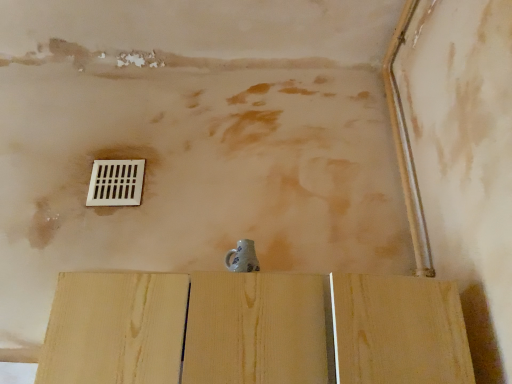
At what (x,y) coordinates should I click in order to perform the action: click on white plastic vent at upper center. Please return your answer as a coordinate pair (x, y). The width and height of the screenshot is (512, 384). Looking at the image, I should click on (116, 183).

Describe the element at coordinates (116, 183) in the screenshot. Image resolution: width=512 pixels, height=384 pixels. I see `white plastic vent at upper center` at that location.

Based on the photo, what is the approximate height of natural wood plywood at center?

It is 10.41 inches.

In order to face natural wood plywood at center, should I rotate leftwards or rightwards?

You should look right and rotate roughly 0.586 degrees.

Where is `natural wood plywood at center`? The height and width of the screenshot is (384, 512). natural wood plywood at center is located at coordinates (255, 329).

This screenshot has height=384, width=512. What do you see at coordinates (255, 329) in the screenshot? I see `natural wood plywood at center` at bounding box center [255, 329].

Locate an element on the screen. white plastic vent at upper center is located at coordinates (116, 183).

Consider the image. Would you say natural wood plywood at center is to the left or to the right of white plastic vent at upper center in the picture?

Based on their positions, natural wood plywood at center is located to the right of white plastic vent at upper center.

Is natural wood plywood at center in front of or behind white plastic vent at upper center in the image?

Clearly, natural wood plywood at center is in front of white plastic vent at upper center.

Between point (98, 287) and point (136, 194), which one is positioned behind?

Point (136, 194)

From the image's perspective, relative to white plastic vent at upper center, is natural wood plywood at center above or below?

natural wood plywood at center is below white plastic vent at upper center.

Looking at this image, from a real-world perspective, between natural wood plywood at center and white plastic vent at upper center, who is vertically higher?

white plastic vent at upper center is physically above.

Which of these two, natural wood plywood at center or white plastic vent at upper center, is wider?

natural wood plywood at center.

Considering the relative sizes of natural wood plywood at center and white plastic vent at upper center in the image provided, is natural wood plywood at center taller than white plastic vent at upper center?

Indeed, natural wood plywood at center has a greater height compared to white plastic vent at upper center.

Looking at the image, does natural wood plywood at center seem bigger or smaller compared to white plastic vent at upper center?

In the image, natural wood plywood at center appears to be larger than white plastic vent at upper center.

Is white plastic vent at upper center a part of natural wood plywood at center?

No, white plastic vent at upper center is not surrounded by natural wood plywood at center.

Can you see natural wood plywood at center touching white plastic vent at upper center?

No, natural wood plywood at center is not in contact with white plastic vent at upper center.

Based on the photo, is natural wood plywood at center looking in the opposite direction of white plastic vent at upper center?

No, white plastic vent at upper center is not at the back of natural wood plywood at center.

At what (x,y) coordinates should I click in order to perform the action: click on plywood on the right of white plastic vent at upper center. Please return your answer as a coordinate pair (x, y). Looking at the image, I should click on (255, 329).

Is white plastic vent at upper center at the right side of natural wood plywood at center?

In fact, white plastic vent at upper center is to the left of natural wood plywood at center.

Is white plastic vent at upper center in front of or behind natural wood plywood at center in the image?

In the image, white plastic vent at upper center appears behind natural wood plywood at center.

Does point (111, 163) come closer to viewer compared to point (237, 333)?

That is False.

Consider the image. From the image's perspective, would you say white plastic vent at upper center is positioned over natural wood plywood at center?

Indeed, from the image's perspective, white plastic vent at upper center is shown above natural wood plywood at center.

From a real-world perspective, which object rests below the other?

natural wood plywood at center, from a real-world perspective.

Consider the image. Can you confirm if white plastic vent at upper center is wider than natural wood plywood at center?

No.

Considering the relative sizes of white plastic vent at upper center and natural wood plywood at center in the image provided, is white plastic vent at upper center shorter than natural wood plywood at center?

Yes, white plastic vent at upper center is shorter than natural wood plywood at center.

Is white plastic vent at upper center bigger than natural wood plywood at center?

No, white plastic vent at upper center is not bigger than natural wood plywood at center.

Would you say white plastic vent at upper center is outside natural wood plywood at center?

Yes.

Is white plastic vent at upper center placed right next to natural wood plywood at center?

white plastic vent at upper center and natural wood plywood at center are clearly separated.

Is white plastic vent at upper center facing away from natural wood plywood at center?

That's not correct — white plastic vent at upper center is not looking away from natural wood plywood at center.

I want to click on plywood to the right of white plastic vent at upper center, so click(x=255, y=329).

Locate an element on the screen. This screenshot has width=512, height=384. window above the natural wood plywood at center (from the image's perspective) is located at coordinates (116, 183).

Where is `plywood lying on the right of white plastic vent at upper center`? Image resolution: width=512 pixels, height=384 pixels. plywood lying on the right of white plastic vent at upper center is located at coordinates (255, 329).